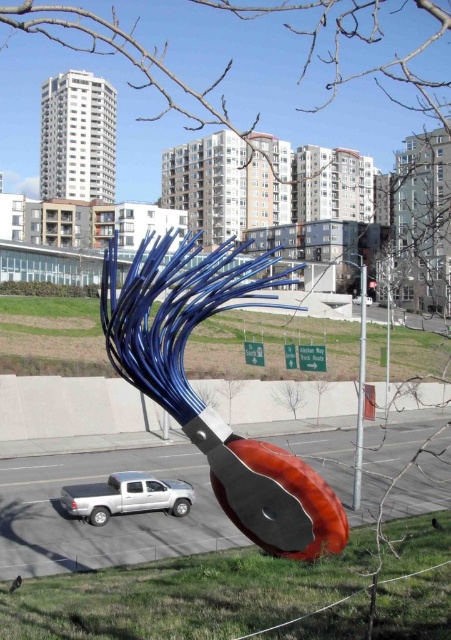
Question: Is shiny metallic sculpture at center to the left of silver metallic truck at lower left from the viewer's perspective?

Choices:
 (A) no
 (B) yes

Answer: (A)

Question: Which of these objects is positioned farthest from the shiny metallic sculpture at center?

Choices:
 (A) white glossy car at center
 (B) metallic silver pole at center
 (C) silver metallic truck at lower left

Answer: (A)

Question: Is shiny metallic sculpture at center to the left of white glossy car at center from the viewer's perspective?

Choices:
 (A) yes
 (B) no

Answer: (A)

Question: Which of the following is the closest to the observer?

Choices:
 (A) (372, 301)
 (B) (360, 259)

Answer: (A)

Question: Which point is closer to the camera?

Choices:
 (A) (368, 301)
 (B) (106, 250)
 (C) (84, 490)

Answer: (B)

Question: Is shiny metallic sculpture at center further to camera compared to white glossy car at center?

Choices:
 (A) yes
 (B) no

Answer: (B)